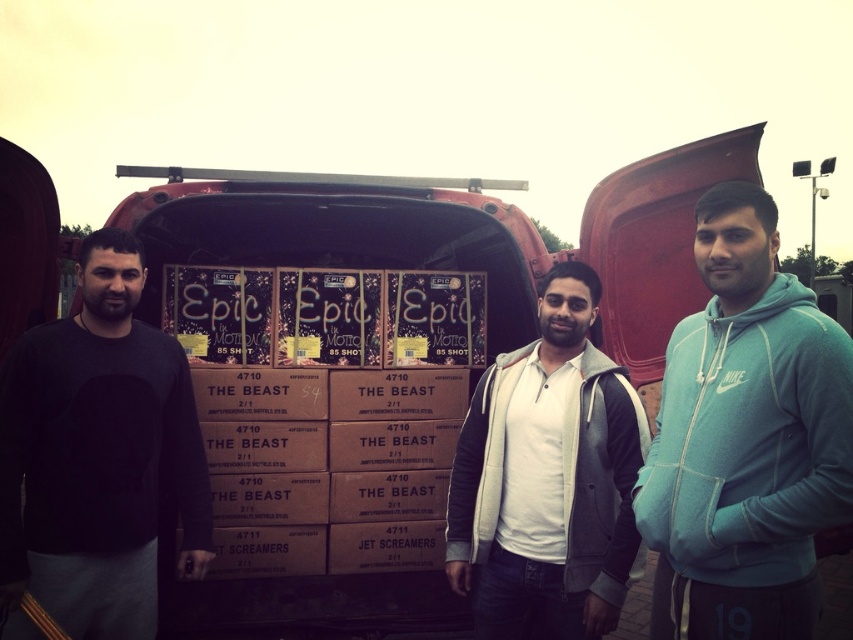
You are a photographer trying to capture a clear shot of the teal fleece hoodie at center and the white fleece jacket at center. Since both are at the center, which one is blocking the other from view?

The teal fleece hoodie at center is in front of the white fleece jacket at center, so it is blocking the view of the white fleece jacket at center.

You are standing in front of the red vehicle with its rear hatch open. There are two points marked in the image. The first point is at coordinates point (659, 579) and the second point is at point (622, 368). Which of these points is closer to you?

Point (659, 579) is closer to the camera than point (622, 368).

You are a photographer trying to capture a photo of the teal fleece hoodie at center and the black matte sweatshirt at left. From the perspective of someone looking at the image, which of these two items is positioned higher?

The teal fleece hoodie at center is positioned higher than the black matte sweatshirt at left.